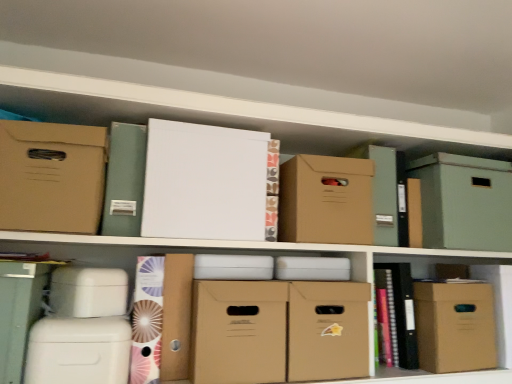
Question: From a real-world perspective, is matte brown cardboard box at upper center, acting as the 3th cardboard box starting from the right, physically located above or below matte brown cardboard box at center, marked as the third cardboard box in a left-to-right arrangement?

Choices:
 (A) below
 (B) above

Answer: (B)

Question: Is matte brown cardboard box at upper center, placed as the 5th cardboard box when sorted from left to right, inside the boundaries of matte brown cardboard box at center, arranged as the fifth cardboard box when viewed from the right, or outside?

Choices:
 (A) outside
 (B) inside

Answer: (A)

Question: Which object is positioned farthest from the patterned paper folder at lower left, the first book from the bottom?

Choices:
 (A) matte brown cardboard box at upper center, acting as the 3th cardboard box starting from the right
 (B) matte cardboard box at lower right
 (C) white matte storage box at lower left
 (D) white cardboard box at upper center, the second cardboard box positioned from the left
 (E) matte brown cardboard box at center, which appears as the fourth cardboard box when viewed from the right

Answer: (B)

Question: Which object is positioned closest to the matte brown cardboard box at center, arranged as the fifth cardboard box when viewed from the right?

Choices:
 (A) green cardboard box at upper right, the sixth cardboard box viewed from the left
 (B) matte green file at upper left, which is counted as the second book, starting from the bottom
 (C) matte brown cardboard box at lower right, which is the 7th cardboard box from left to right
 (D) white cardboard box at upper center, the sixth cardboard box from the right
 (E) white matte storage box at lower left

Answer: (D)